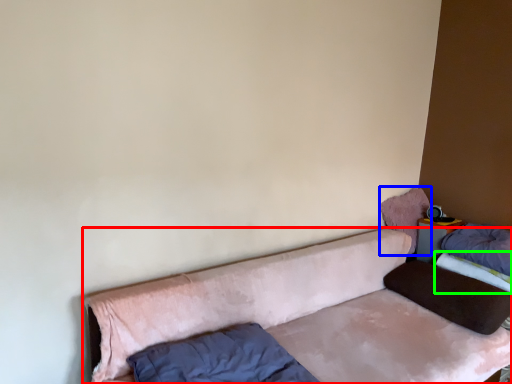
Question: Which object is the closest to the studio couch (highlighted by a red box)? Choose among these: pillow (highlighted by a blue box) or mattress (highlighted by a green box).

Choices:
 (A) pillow
 (B) mattress

Answer: (A)